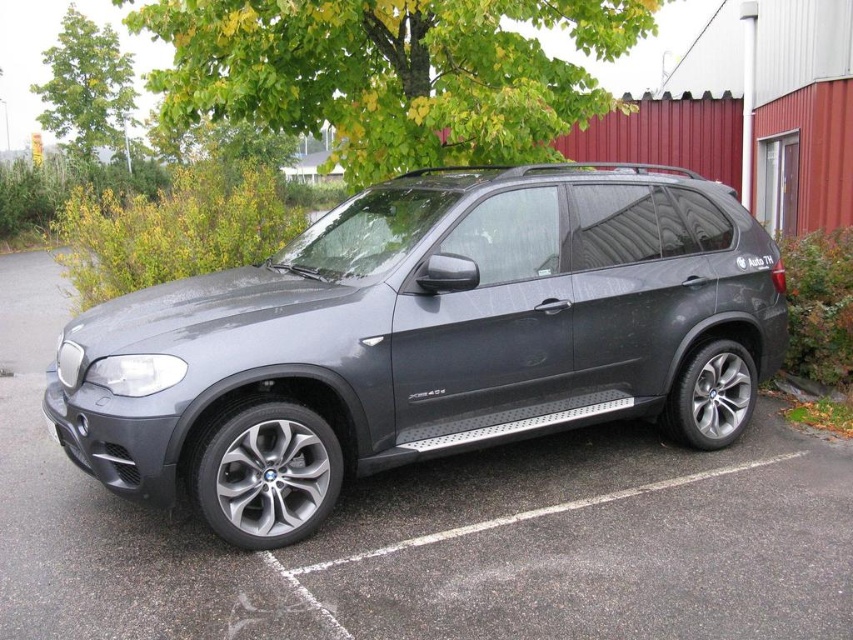
You are a delivery driver who needs to park your truck in the parking lot. The truck is the same size as the satin metallic suv at center. There is a parking spot next to the green leafy tree at upper center. Can your truck fit in that parking spot?

The satin metallic suv at center is larger than the green leafy tree at upper center. Since the truck is the same size as the satin metallic suv at center, it should be able to fit in the parking spot next to the green leafy tree at upper center as the parking spot is likely sized for vehicles of that scale.

You are standing at the point marked by the coordinates point (390, 72). What object is directly above you in the scene?

The green leafy tree at upper center is located at point (390, 72), so the object directly above you is the green leafy tree at upper center.